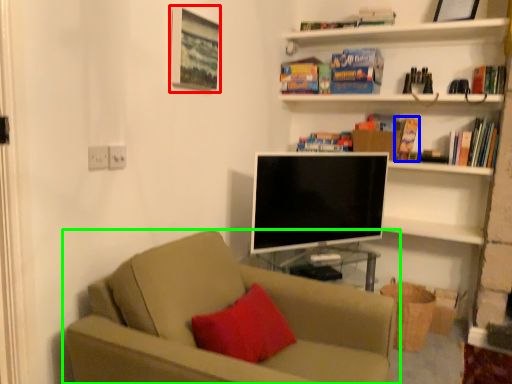
Question: Which object is positioned closest to picture frame (highlighted by a red box)? Select from paperback book (highlighted by a blue box) and studio couch (highlighted by a green box).

Choices:
 (A) paperback book
 (B) studio couch

Answer: (B)